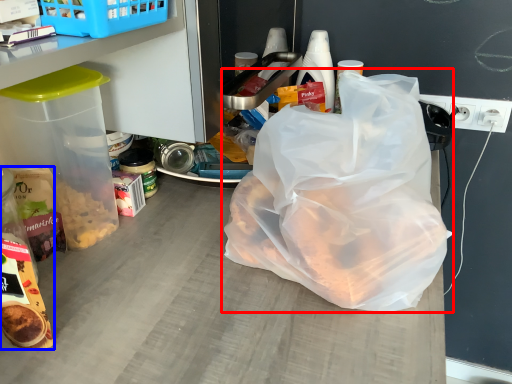
Question: Which point is closer to the camera, plastic bag (highlighted by a red box) or snack (highlighted by a blue box)?

Choices:
 (A) plastic bag
 (B) snack

Answer: (A)